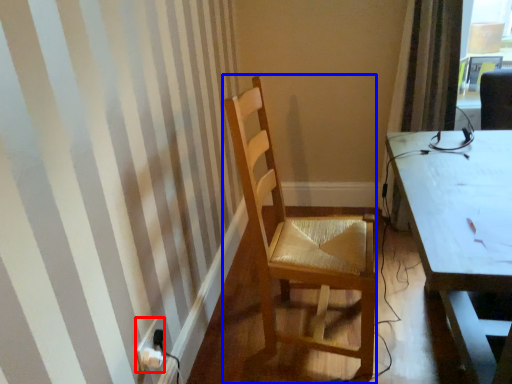
Question: Which of the following is the farthest to the observer, power plugs and sockets (highlighted by a red box) or chair (highlighted by a blue box)?

Choices:
 (A) power plugs and sockets
 (B) chair

Answer: (A)